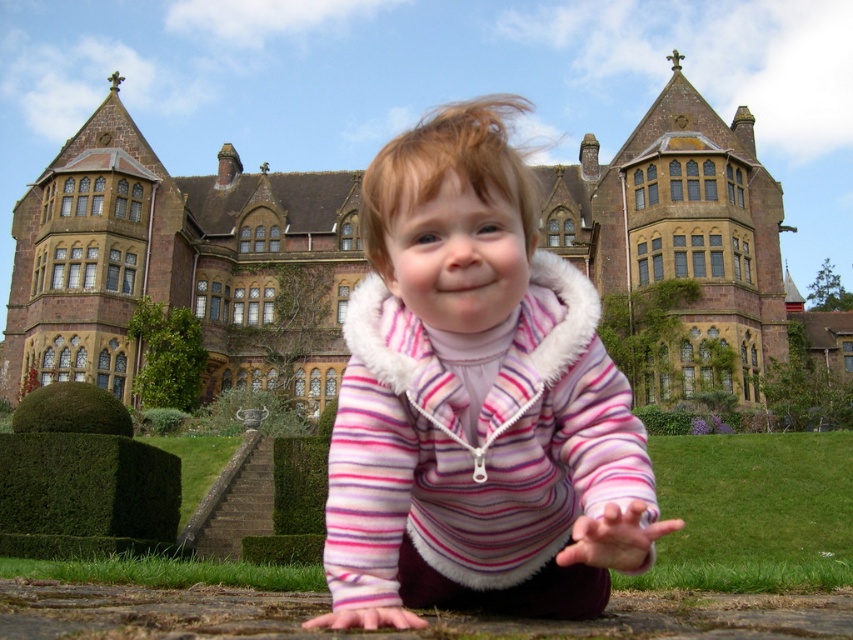
You are a photographer trying to capture the pink striped fleece at center and the brown stone mansion at center in the same frame. Based on their positions, which object should you focus on first to ensure both are in the shot?

The pink striped fleece at center is positioned under the brown stone mansion at center, so you should focus on the brown stone mansion at center first to ensure both are in the shot.

Based on the photo, you are a photographer standing at the location of the pink striped fleece at center and want to take a photo of the brown stone mansion at center. Given that your camera has a maximum focus range of 100 feet, will you be able to capture the mansion clearly?

The pink striped fleece at center and brown stone mansion at center are 116.60 feet apart. Since the distance exceeds the camera maximum focus range of 100 feet, you won both be able to capture the mansion clearly.

You are standing in front of a historic building and want to take a photo of the point at coordinates point (376, 189). If your camera can focus on objects up to 30 meters away, will it be able to capture that point clearly?

The distance of point (376, 189) from the camera is 32.31 meters, which is beyond the camera focus range of 30 meters. Therefore, the camera cannot capture the point clearly.